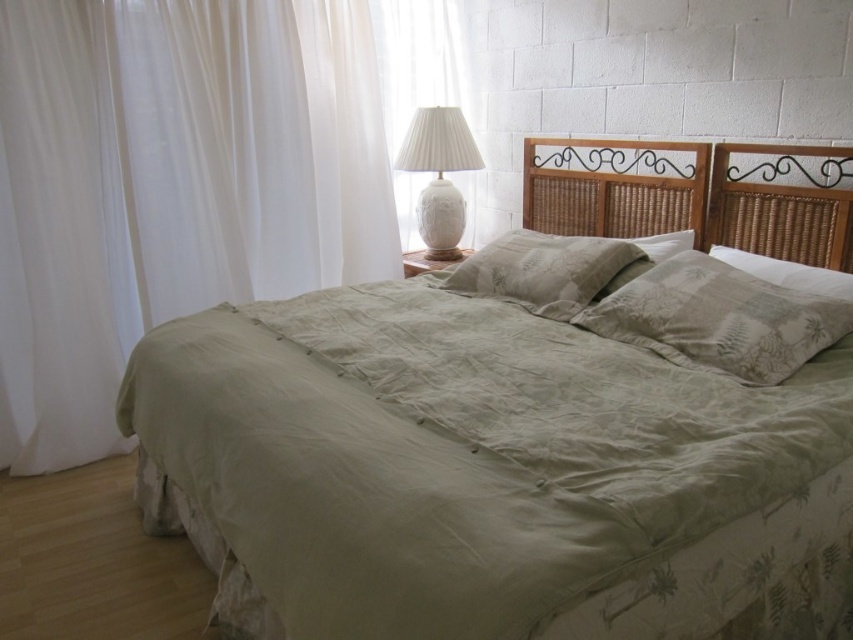
Question: Where is textured beige pillow at center located in relation to rattan wood headboard at center in the image?

Choices:
 (A) below
 (B) above

Answer: (A)

Question: Where is white sheer curtain at left located in relation to sage green fabric pillow at right in the image?

Choices:
 (A) right
 (B) left

Answer: (B)

Question: Which is farther from the rattan wood headboard at center?

Choices:
 (A) white sheer curtain at left
 (B) sage green fabric pillow at right

Answer: (A)

Question: Which is farther from the sage green fabric bed at center?

Choices:
 (A) sage green fabric pillow at center
 (B) white sheer curtain at left
 (C) textured beige pillow at center

Answer: (B)

Question: Which of the following is the farthest from the observer?

Choices:
 (A) (672, 182)
 (B) (531, 214)
 (C) (154, 176)
 (D) (782, 307)

Answer: (B)

Question: Is the position of sage green fabric bed at center less distant than that of white ceramic lamp at upper center?

Choices:
 (A) yes
 (B) no

Answer: (A)